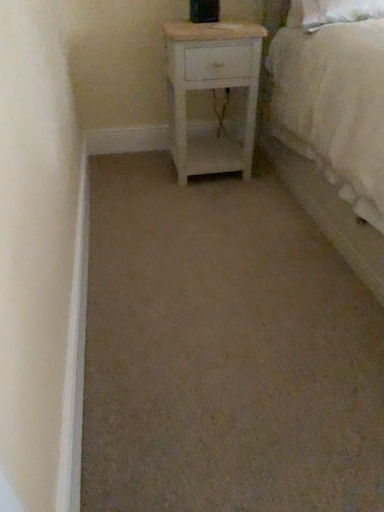
In order to face white wood nightstand at center, should I rotate leftwards or rightwards?

A 2.799 degree turn to the right will do.

The width and height of the screenshot is (384, 512). Find the location of `white wood nightstand at center`. white wood nightstand at center is located at coordinates (213, 92).

The height and width of the screenshot is (512, 384). What do you see at coordinates (213, 92) in the screenshot?
I see `white wood nightstand at center` at bounding box center [213, 92].

Measure the distance between point (239, 48) and camera.

A distance of 1.71 meters exists between point (239, 48) and camera.

Where is `white wood nightstand at center`? The height and width of the screenshot is (512, 384). white wood nightstand at center is located at coordinates (213, 92).